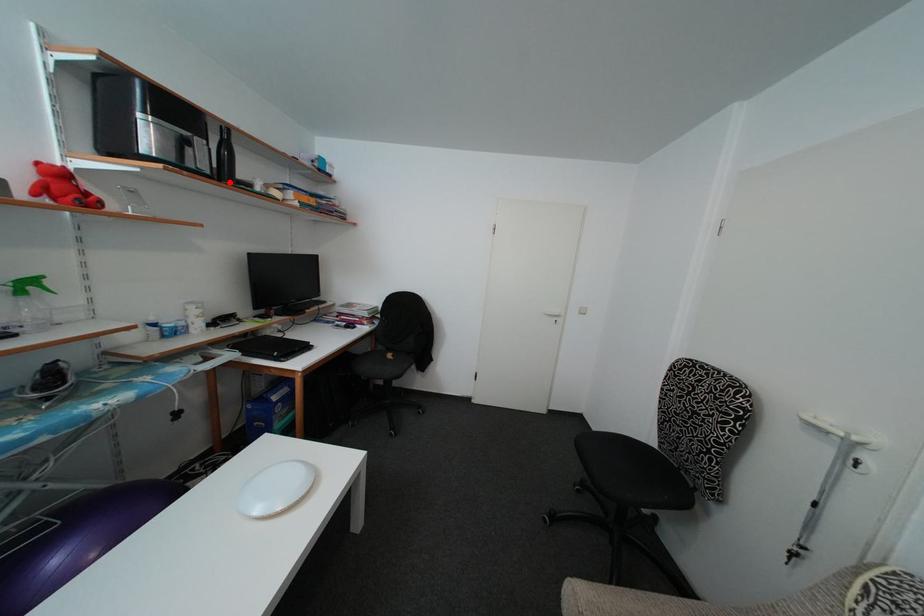
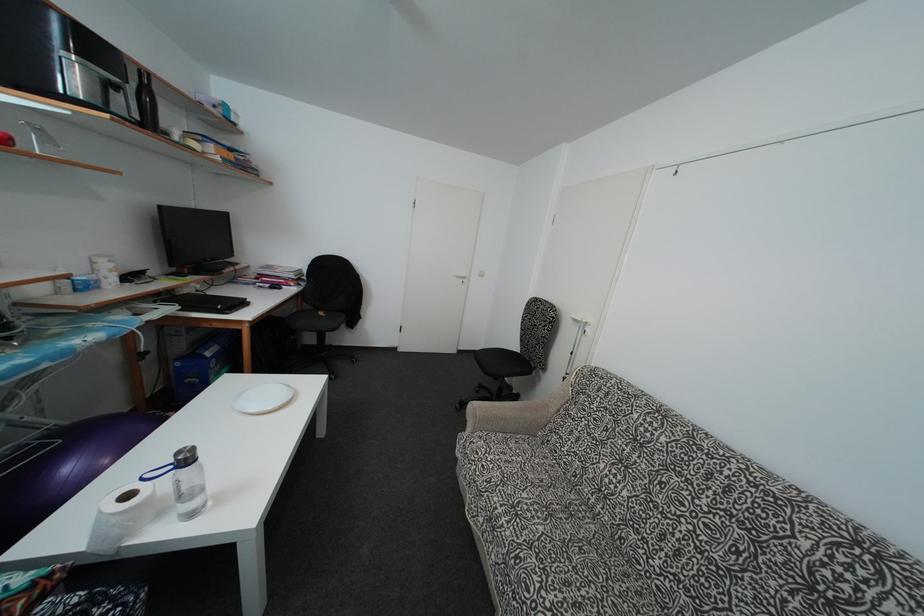
Where in the second image is the point corresponding to the highlighted location from the first image?

(152, 131)